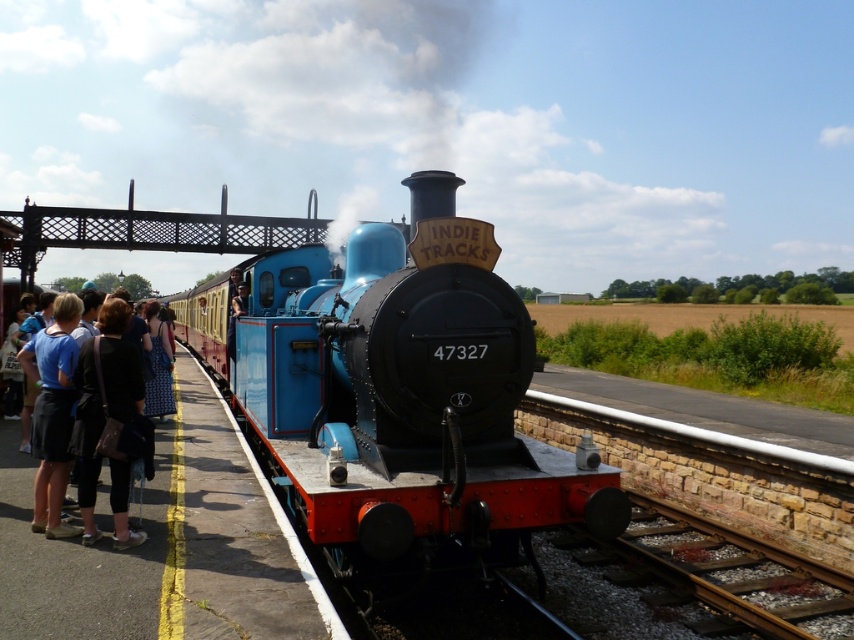
You are a photographer standing at the railway station. You want to take a photo of the blue polished wood train at center. The minimum focusing distance for your camera is 15 feet. Will you be able to take a clear photo without moving closer?

The distance between the blue polished wood train at center and the camera is 14.69 feet, which is less than the minimum focusing distance of 15 feet. Therefore, you will not be able to take a clear photo without moving closer.

You are a passenger waiting on the platform and want to board the blue polished wood train at center. There is a matte blue skirt at left blocking your path. Can you walk around the skirt to reach the train?

The blue polished wood train at center is in front of the matte blue skirt at left, meaning the skirt is behind the train. Therefore, you can walk around the skirt to reach the train since it is not blocking your path.

You are standing at the railway station and want to walk from point (512, 484) to point (57, 298). Which direction should you move relative to the steam locomotive labeled INDIE TRACKS 47327?

You should move away from the steam locomotive labeled INDIE TRACKS 47327 because point (57, 298) is farther from the viewer compared to point (512, 484).